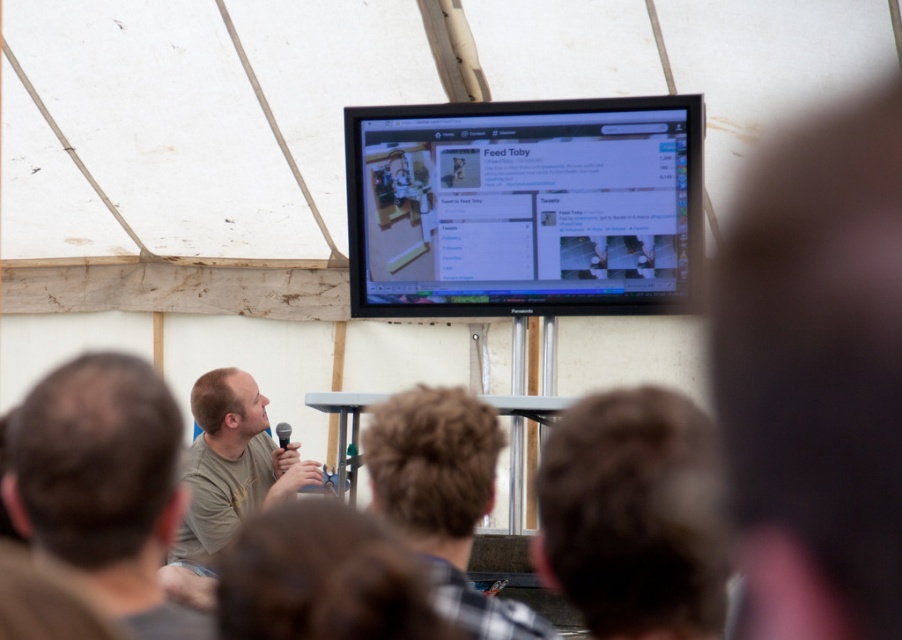
Is point (608, 128) less distant than point (229, 536)?

Yes, point (608, 128) is in front of point (229, 536).

Is point (609, 128) in front of point (251, 390)?

Yes, it is.

The width and height of the screenshot is (902, 640). What are the coordinates of `matte black monitor at upper center` in the screenshot? It's located at (523, 208).

Does matte black monitor at upper center appear on the left side of brown hair at upper center?

Yes, matte black monitor at upper center is to the left of brown hair at upper center.

Is the position of matte black monitor at upper center less distant than that of brown hair at upper center?

No, matte black monitor at upper center is further to the viewer.

Find the location of `matte black monitor at upper center`. matte black monitor at upper center is located at coordinates (523, 208).

Is matte khaki shirt at lower left closer to camera compared to black plastic microphone at upper center?

Yes.

Can you confirm if matte khaki shirt at lower left is positioned to the left of black plastic microphone at upper center?

Yes, matte khaki shirt at lower left is to the left of black plastic microphone at upper center.

Describe the element at coordinates (231, 467) in the screenshot. I see `matte khaki shirt at lower left` at that location.

Find the location of a particular element. matte khaki shirt at lower left is located at coordinates pyautogui.click(x=231, y=467).